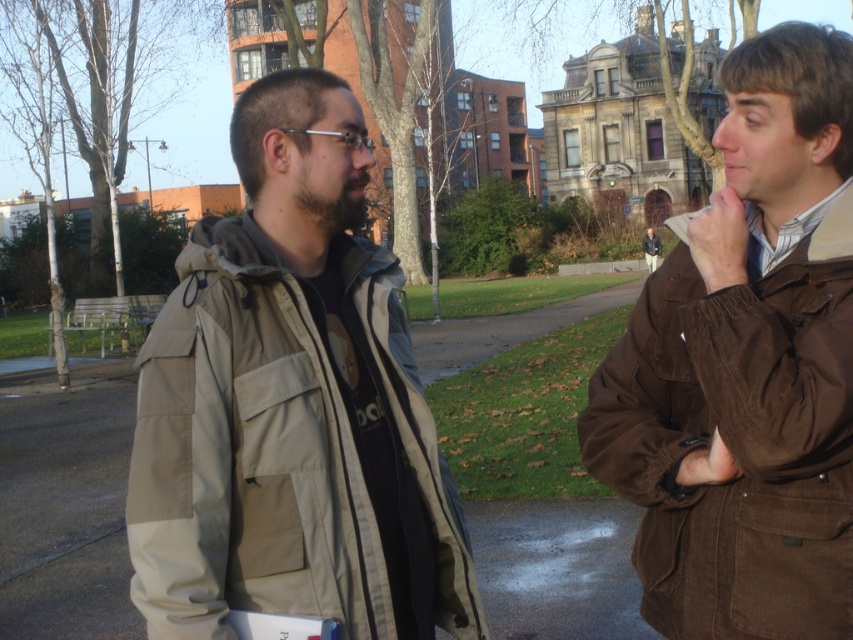
Can you confirm if khaki fabric jacket at left is bigger than brown corduroy jacket at right?

Yes.

Can you confirm if khaki fabric jacket at left is positioned above brown corduroy jacket at right?

Yes, khaki fabric jacket at left is above brown corduroy jacket at right.

What do you see at coordinates (291, 404) in the screenshot?
I see `khaki fabric jacket at left` at bounding box center [291, 404].

This screenshot has height=640, width=853. I want to click on khaki fabric jacket at left, so click(x=291, y=404).